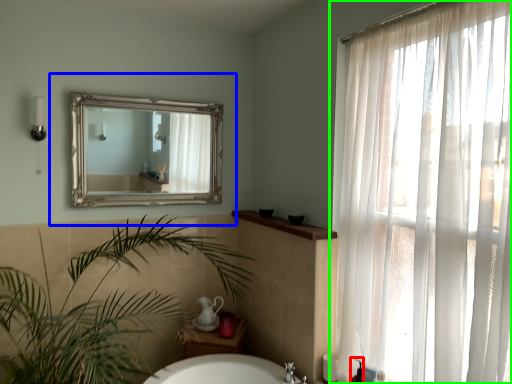
Question: Which object is positioned closest to toiletry (highlighted by a red box)? Select from medicine cabinet (highlighted by a blue box) and curtain (highlighted by a green box).

Choices:
 (A) medicine cabinet
 (B) curtain

Answer: (B)